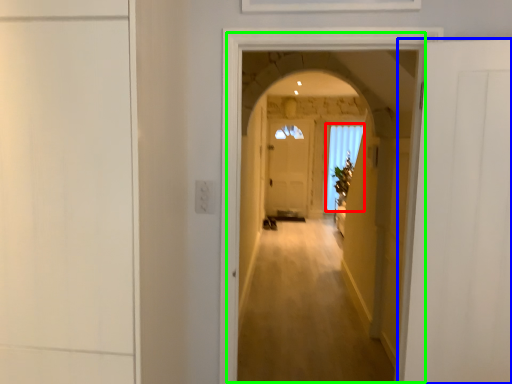
Question: Estimate the real-world distances between objects in this image. Which object is farther from window (highlighted by a red box), door (highlighted by a blue box) or corridor (highlighted by a green box)?

Choices:
 (A) door
 (B) corridor

Answer: (A)